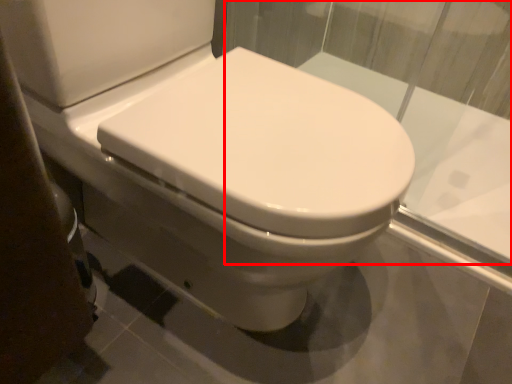
Question: From the image, what is the correct spatial relationship of glass window (annotated by the red box) in relation to bidet?

Choices:
 (A) right
 (B) left

Answer: (A)